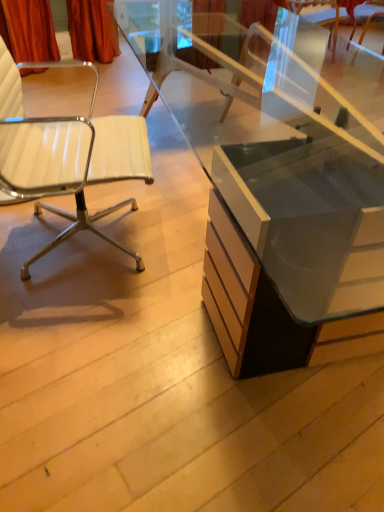
The width and height of the screenshot is (384, 512). I want to click on white leather chair at left, which is the first chair in left-to-right order, so click(x=102, y=152).

Identify the location of matte glass desk at center. The image size is (384, 512). (277, 176).

From a real-world perspective, is matte glass desk at center above or below white leather chair at left, which ranks as the 2th chair in back-to-front order?

matte glass desk at center is below white leather chair at left, which ranks as the 2th chair in back-to-front order.

Where is `desk below the white leather chair at left, the 2th chair in the right-to-left sequence (from a real-world perspective)`? The height and width of the screenshot is (512, 384). desk below the white leather chair at left, the 2th chair in the right-to-left sequence (from a real-world perspective) is located at coordinates (277, 176).

Considering the relative sizes of matte glass desk at center and white leather chair at left, which ranks as the 2th chair in back-to-front order, in the image provided, is matte glass desk at center taller than white leather chair at left, which ranks as the 2th chair in back-to-front order,?

Incorrect, the height of matte glass desk at center is not larger of that of white leather chair at left, which ranks as the 2th chair in back-to-front order.

Would you say matte glass desk at center is a long distance from white leather chair at left, which is the first chair in left-to-right order?

That's right, there is a large distance between matte glass desk at center and white leather chair at left, which is the first chair in left-to-right order.

Between point (368, 7) and point (70, 61), which one is positioned in front?

The point (368, 7) is more forward.

Is white leather chair at upper right, arranged as the 2th chair when viewed from the left, positioned with its back to white leather chair at left, which ranks as the second chair in top-to-bottom order?

white leather chair at upper right, arranged as the 2th chair when viewed from the left, is not turned away from white leather chair at left, which ranks as the second chair in top-to-bottom order.

In the image, there is a white leather chair at left, which ranks as the second chair in top-to-bottom order. Where is `chair below it (from a real-world perspective)`? The image size is (384, 512). chair below it (from a real-world perspective) is located at coordinates (367, 19).

From the image's perspective, relative to white leather chair at left, marked as the first chair in a front-to-back arrangement, is white leather chair at upper right, marked as the second chair in a front-to-back arrangement, above or below?

Clearly, from the image's perspective, white leather chair at upper right, marked as the second chair in a front-to-back arrangement, is above white leather chair at left, marked as the first chair in a front-to-back arrangement.

This screenshot has height=512, width=384. Find the location of `chair to the right of matte glass desk at center`. chair to the right of matte glass desk at center is located at coordinates (367, 19).

Looking at this image, how distant is white leather chair at upper right, arranged as the first chair when viewed from the right, from matte glass desk at center?

white leather chair at upper right, arranged as the first chair when viewed from the right, and matte glass desk at center are 1.05 meters apart from each other.

Which is more to the left, white leather chair at upper right, arranged as the first chair when viewed from the right, or matte glass desk at center?

From the viewer's perspective, matte glass desk at center appears more on the left side.

Can we say white leather chair at upper right, marked as the second chair in a front-to-back arrangement, lies outside matte glass desk at center?

Yes.

Would you say matte glass desk at center is part of white leather chair at left, the 2th chair in the right-to-left sequence,'s contents?

That's incorrect, matte glass desk at center is not inside white leather chair at left, the 2th chair in the right-to-left sequence.

Looking at this image, can you confirm if white leather chair at left, the 2th chair in the right-to-left sequence, is bigger than matte glass desk at center?

Actually, white leather chair at left, the 2th chair in the right-to-left sequence, might be smaller than matte glass desk at center.

Between white leather chair at left, which ranks as the first chair in bottom-to-top order, and matte glass desk at center, which one has more height?

With more height is white leather chair at left, which ranks as the first chair in bottom-to-top order.

Is point (6, 54) closer or farther from the camera than point (301, 351)?

Point (6, 54).

Which object is further away from the camera taking this photo, matte glass desk at center or white leather chair at upper right, which is the 2th chair in bottom-to-top order?

white leather chair at upper right, which is the 2th chair in bottom-to-top order, is more distant.

In the scene shown: Is matte glass desk at center oriented towards white leather chair at upper right, arranged as the 2th chair when viewed from the left?

No.

From the image's perspective, does matte glass desk at center appear higher than white leather chair at upper right, which is the 2th chair in bottom-to-top order?

No, from the image's perspective, matte glass desk at center is not over white leather chair at upper right, which is the 2th chair in bottom-to-top order.

From a real-world perspective, is matte glass desk at center above or below white leather chair at upper right, acting as the first chair starting from the back?

Clearly, from a real-world perspective, matte glass desk at center is above white leather chair at upper right, acting as the first chair starting from the back.

Is the surface of white leather chair at left, which ranks as the first chair in bottom-to-top order, in direct contact with white leather chair at upper right, acting as the 1th chair starting from the top?

No, white leather chair at left, which ranks as the first chair in bottom-to-top order, is not making contact with white leather chair at upper right, acting as the 1th chair starting from the top.

How different are the orientations of white leather chair at left, which ranks as the 2th chair in back-to-front order, and white leather chair at upper right, arranged as the first chair when viewed from the right, in degrees?

20 degrees separate the facing orientations of white leather chair at left, which ranks as the 2th chair in back-to-front order, and white leather chair at upper right, arranged as the first chair when viewed from the right.

Is white leather chair at left, marked as the first chair in a front-to-back arrangement, thinner than white leather chair at upper right, arranged as the first chair when viewed from the right?

No.

Does white leather chair at left, marked as the first chair in a front-to-back arrangement, appear on the right side of white leather chair at upper right, arranged as the 2th chair when viewed from the left?

In fact, white leather chair at left, marked as the first chair in a front-to-back arrangement, is to the left of white leather chair at upper right, arranged as the 2th chair when viewed from the left.

I want to click on chair that is the 1st one when counting backward from the matte glass desk at center, so click(x=102, y=152).

In the image, there is a white leather chair at upper right, arranged as the first chair when viewed from the right. Where is `chair below it (from the image's perspective)`? This screenshot has height=512, width=384. chair below it (from the image's perspective) is located at coordinates (102, 152).

Estimate the real-world distances between objects in this image. Which object is closer to white leather chair at upper right, which is the 2th chair in bottom-to-top order, matte glass desk at center or white leather chair at left, which ranks as the 2th chair in back-to-front order?

matte glass desk at center is closer to white leather chair at upper right, which is the 2th chair in bottom-to-top order.

When comparing their distances from white leather chair at left, marked as the first chair in a front-to-back arrangement, does matte glass desk at center or white leather chair at upper right, acting as the 1th chair starting from the top, seem further?

Based on the image, white leather chair at upper right, acting as the 1th chair starting from the top, appears to be further to white leather chair at left, marked as the first chair in a front-to-back arrangement.

Looking at the image, which one is located closer to matte glass desk at center, white leather chair at left, which is the first chair in left-to-right order, or white leather chair at upper right, arranged as the 2th chair when viewed from the left?

white leather chair at upper right, arranged as the 2th chair when viewed from the left, lies closer to matte glass desk at center than the other object.

Which object lies nearer to the anchor point matte glass desk at center, white leather chair at upper right, acting as the first chair starting from the back, or white leather chair at left, the 2th chair in the right-to-left sequence?

The object closer to matte glass desk at center is white leather chair at upper right, acting as the first chair starting from the back.

From the image, which object appears to be nearer to white leather chair at left, which ranks as the 2th chair in back-to-front order, white leather chair at upper right, acting as the first chair starting from the back, or matte glass desk at center?

matte glass desk at center.

From the image, which object appears to be farther from white leather chair at upper right, which is the 2th chair in bottom-to-top order, white leather chair at left, which is the first chair in left-to-right order, or matte glass desk at center?

Among the two, white leather chair at left, which is the first chair in left-to-right order, is located further to white leather chair at upper right, which is the 2th chair in bottom-to-top order.

At what (x,y) coordinates should I click in order to perform the action: click on chair located between matte glass desk at center and white leather chair at upper right, arranged as the 2th chair when viewed from the left, in the depth direction. Please return your answer as a coordinate pair (x, y). This screenshot has width=384, height=512. Looking at the image, I should click on point(102,152).